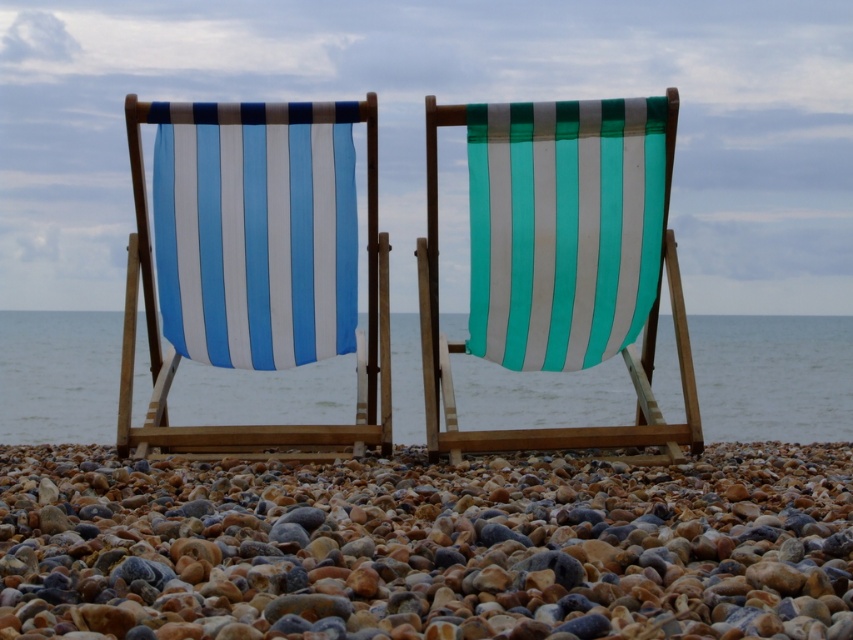
Does blue water at center appear under blue striped fabric at left?

Correct, blue water at center is located below blue striped fabric at left.

Does point (579, 396) come in front of point (312, 268)?

No, it is not.

What do you see at coordinates (773, 376) in the screenshot? I see `blue water at center` at bounding box center [773, 376].

This screenshot has width=853, height=640. I want to click on blue water at center, so click(x=773, y=376).

Who is positioned more to the right, teal striped fabric chair at center or blue water at center?

From the viewer's perspective, teal striped fabric chair at center appears more on the right side.

You are a GUI agent. You are given a task and a screenshot of the screen. Output one action in this format:
    pyautogui.click(x=<x>, y=<y>)
    Task: Click on the teal striped fabric chair at center
    This screenshot has width=853, height=640.
    Given the screenshot: What is the action you would take?
    tap(560, 259)

Is point (492, 200) farther from camera compared to point (256, 408)?

No.

Identify the location of teal striped fabric chair at center. (560, 259).

Is teal striped fabric chair at center bigger than blue striped fabric at left?

Indeed, teal striped fabric chair at center has a larger size compared to blue striped fabric at left.

Is point (601, 202) positioned in front of point (263, 440)?

No, it is behind (263, 440).

Identify the location of teal striped fabric chair at center. This screenshot has height=640, width=853. (560, 259).